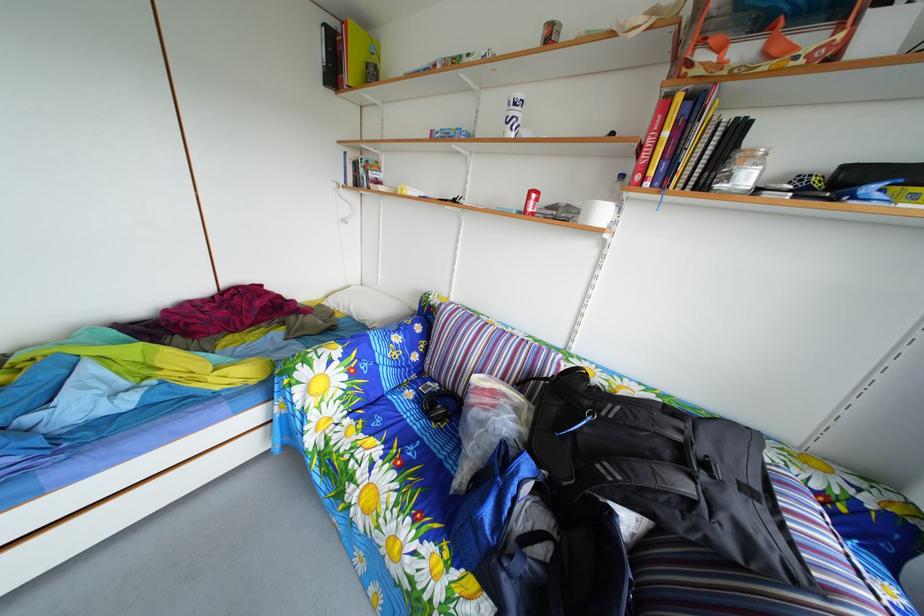
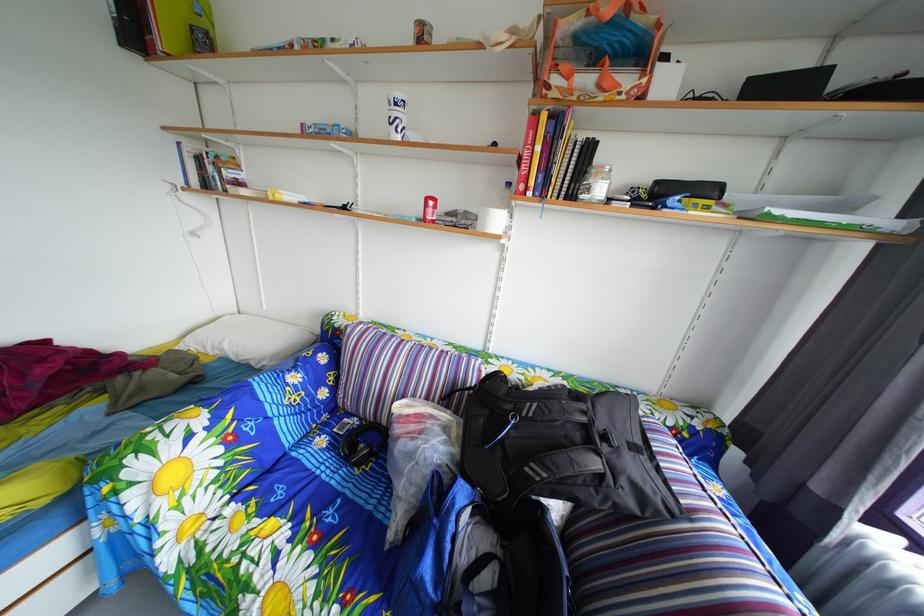
Find the pixel in the second image that matches point 523,116 in the first image.

(404, 116)